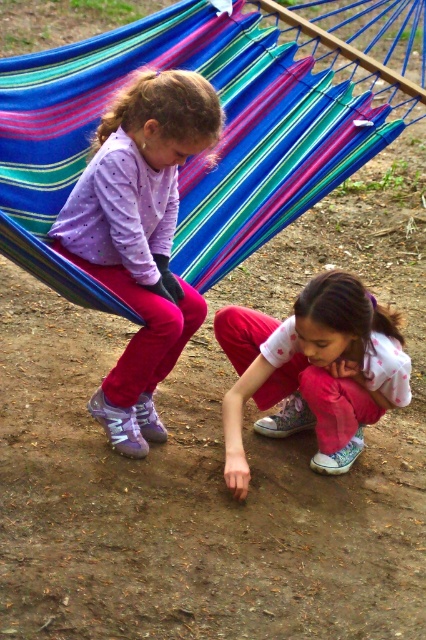
Between purple matte shirt at upper left and pink cotton pants at lower center, which one has more height?

purple matte shirt at upper left is taller.

Can you confirm if purple matte shirt at upper left is positioned below pink cotton pants at lower center?

No.

Is point (72, 189) positioned behind point (388, 340)?

No, (72, 189) is closer to viewer.

Where is `purple matte shirt at upper left`? purple matte shirt at upper left is located at coordinates (140, 237).

Between multicolored striped hammock at upper center and pink cotton pants at lower center, which one has less height?

multicolored striped hammock at upper center

Where is `multicolored striped hammock at upper center`? This screenshot has width=426, height=640. multicolored striped hammock at upper center is located at coordinates (224, 125).

This screenshot has height=640, width=426. Find the location of `multicolored striped hammock at upper center`. multicolored striped hammock at upper center is located at coordinates (224, 125).

Looking at this image, which of these two, multicolored striped hammock at upper center or purple matte shirt at upper left, stands taller?

purple matte shirt at upper left is taller.

What are the coordinates of `multicolored striped hammock at upper center` in the screenshot? It's located at point(224,125).

Is point (2, 196) positioned in front of point (127, 90)?

No, (2, 196) is further to viewer.

Locate an element on the screen. The height and width of the screenshot is (640, 426). multicolored striped hammock at upper center is located at coordinates (224, 125).